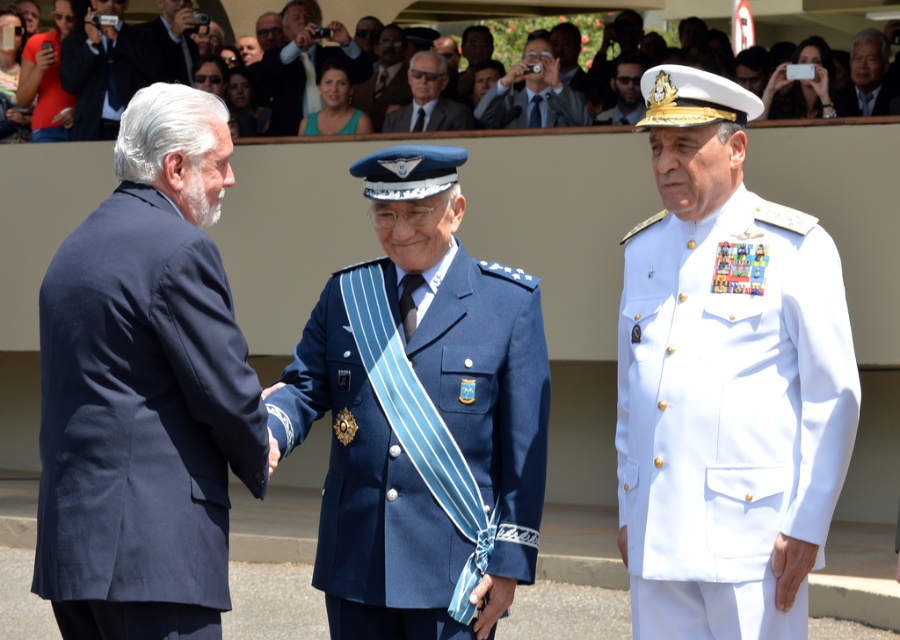
You are a photographer at this event and need to capture a photo of both the matte black suit at upper left and the blue fabric shirt at center. The camera you have can only focus on subjects within a 5 feet range. Will both subjects be in focus?

The matte black suit at upper left and blue fabric shirt at center are 5.25 feet apart. Since the camera can only focus within 5 feet, the distance between them exceeds the focus range, so they will not both be in focus.

You are a photographer at the event. You need to capture a photo where both the matte black suit at upper left and the blue fabric shirt at center are visible. Based on their positions, which one should you ensure is closer to the bottom of the frame?

The matte black suit at upper left is below the blue fabric shirt at center, so to ensure both are visible, the matte black suit at upper left should be closer to the bottom of the frame.